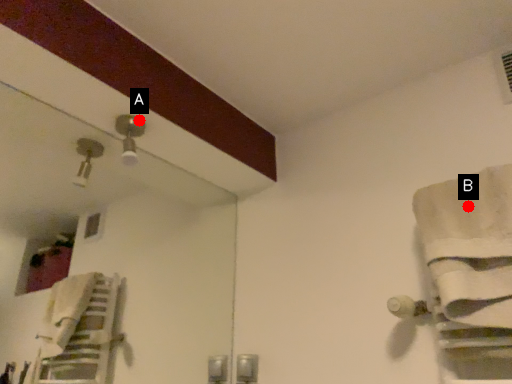
Question: Two points are circled on the image, labeled by A and B beside each circle. Among these points, which one is nearest to the camera?

Choices:
 (A) A is closer
 (B) B is closer

Answer: (B)